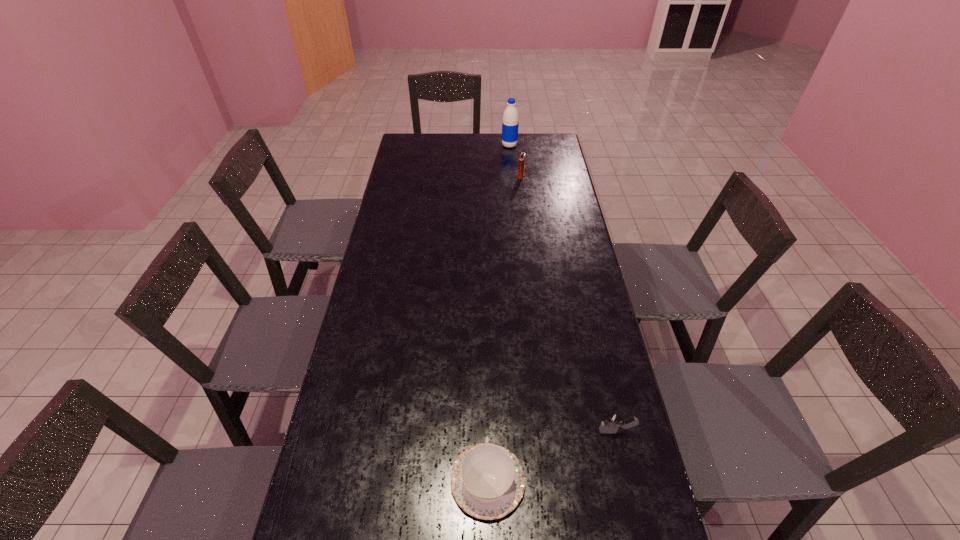
Locate an element on the screen. This screenshot has height=540, width=960. free spot between the farther igniter and the nearest object is located at coordinates (504, 329).

Find the location of `object that is the nearest to the taller igniter`. object that is the nearest to the taller igniter is located at coordinates (510, 123).

Find the location of `object that is the second closest to the left igniter`. object that is the second closest to the left igniter is located at coordinates (611, 422).

At what (x,y) coordinates should I click in order to perform the action: click on free location that satisfies the following two spatial constraints: 1. on the handle side of the third nearest object; 2. on the left side of the leftmost object. Please return your answer as a coordinate pair (x, y). This screenshot has width=960, height=540. Looking at the image, I should click on pyautogui.click(x=484, y=177).

Identify the location of vacant space that satisfies the following two spatial constraints: 1. on the handle side of the farthest object; 2. on the right side of the shortest object. (484, 145).

Locate an element on the screen. free space that satisfies the following two spatial constraints: 1. on the front side of the second tallest object; 2. on the left side of the farthest object is located at coordinates (513, 177).

In order to click on vacant area that satisfies the following two spatial constraints: 1. on the front side of the second nearest object; 2. on the left side of the tallest object in this screenshot , I will do `click(537, 431)`.

Identify the location of vacant space that satisfies the following two spatial constraints: 1. on the handle side of the third nearest object; 2. on the left side of the shortest object. (484, 177).